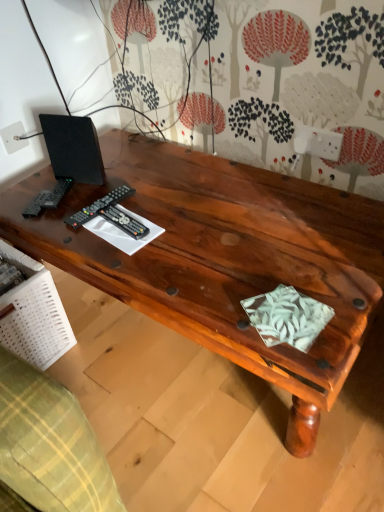
This screenshot has height=512, width=384. Identify the location of vacant area located to the right-hand side of black matte speaker at upper left. (155, 181).